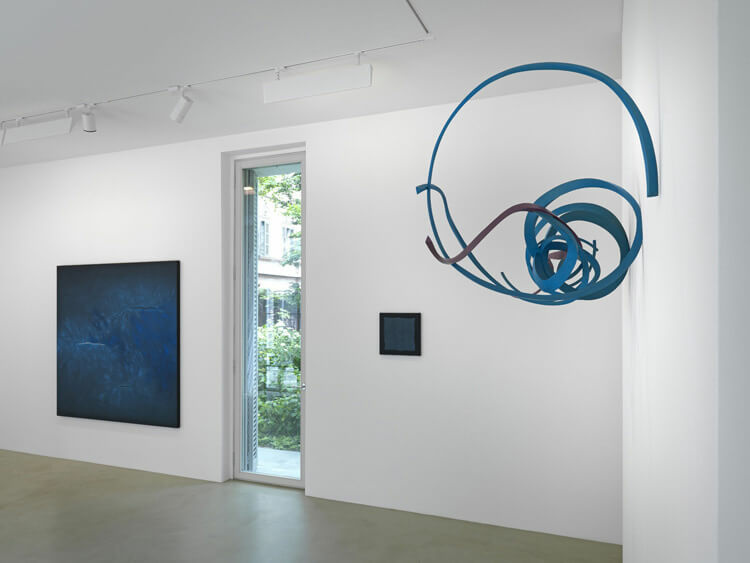
Image resolution: width=750 pixels, height=563 pixels. Identify the location of picture. (152, 348).